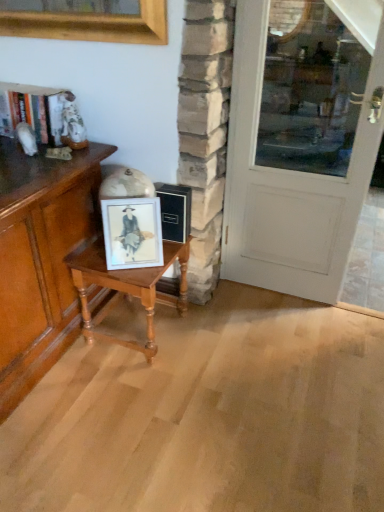
What do you see at coordinates (132, 233) in the screenshot?
I see `matte white frame at center` at bounding box center [132, 233].

This screenshot has height=512, width=384. I want to click on white painted wood door at right, so click(x=301, y=141).

Find the location of `matte white frame at center`. matte white frame at center is located at coordinates (132, 233).

How different are the orientations of wooden table at center and matte white frame at center in degrees?

They differ by 29.9 degrees in their facing directions.

Could matte white frame at center be considered to be inside wooden table at center?

No, matte white frame at center is not surrounded by wooden table at center.

Considering the positions of objects wooden table at center and matte white frame at center in the image provided, who is in front, wooden table at center or matte white frame at center?

Positioned in front is matte white frame at center.

Considering the sizes of wooden table at center and matte white frame at center in the image, is wooden table at center bigger or smaller than matte white frame at center?

In the image, wooden table at center appears to be larger than matte white frame at center.

Based on the photo, visually, is matte white frame at center positioned to the left or to the right of wooden table at center?

matte white frame at center is positioned on wooden table at center's right side.

In the image, is matte white frame at center positioned in front of or behind wooden table at center?

Visually, matte white frame at center is located in front of wooden table at center.

Considering the relative sizes of matte white frame at center and wooden table at center in the image provided, is matte white frame at center thinner than wooden table at center?

Yes, matte white frame at center is thinner than wooden table at center.

Is matte white frame at center in contact with wooden table at center?

No, matte white frame at center is not making contact with wooden table at center.

Is matte wood cabinet at left to the left of white painted wood door at right from the viewer's perspective?

Yes.

Find the location of a particular element. This screenshot has height=512, width=384. cabinetry that is below the white painted wood door at right (from the image's perspective) is located at coordinates (41, 259).

Is matte wood cabinet at left located outside white painted wood door at right?

Yes, matte wood cabinet at left is located beyond the bounds of white painted wood door at right.

Does white painted wood door at right have a greater height compared to matte wood cabinet at left?

Correct, white painted wood door at right is much taller as matte wood cabinet at left.

Consider the image. Could you tell me if white painted wood door at right is facing matte wood cabinet at left?

No.

Is white painted wood door at right thinner than matte wood cabinet at left?

Yes, white painted wood door at right is thinner than matte wood cabinet at left.

The width and height of the screenshot is (384, 512). I want to click on cabinetry on the left of white painted wood door at right, so click(41, 259).

Measure the distance from matte wood cabinet at left to wooden table at center.

matte wood cabinet at left is 8.88 inches from wooden table at center.

From the image's perspective, which is above, matte wood cabinet at left or wooden table at center?

matte wood cabinet at left appears higher in the image.

From a real-world perspective, does matte wood cabinet at left sit lower than wooden table at center?

Actually, matte wood cabinet at left is physically above wooden table at center in the real world.

Which of these two, matte wood cabinet at left or wooden table at center, is wider?

Wider between the two is matte wood cabinet at left.

Who is shorter, wooden table at center or white painted wood door at right?

wooden table at center is shorter.

The image size is (384, 512). I want to click on door above the wooden table at center (from a real-world perspective), so click(301, 141).

Which of these two, wooden table at center or white painted wood door at right, is smaller?

wooden table at center is smaller.

In the scene shown: Is there a large distance between wooden table at center and white painted wood door at right?

wooden table at center is positioned a significant distance from white painted wood door at right.

Identify the location of picture frame above the matte wood cabinet at left (from a real-world perspective). (132, 233).

Are matte wood cabinet at left and matte white frame at center located far from each other?

No, matte wood cabinet at left is not far away from matte white frame at center.

In the scene shown: Which point is more forward, (55, 317) or (129, 239)?

The point (129, 239) is more forward.

Identify the location of table on the left of matte white frame at center. This screenshot has height=512, width=384. (126, 288).

Image resolution: width=384 pixels, height=512 pixels. In the image, there is a matte white frame at center. In order to click on table below it (from a real-world perspective) in this screenshot , I will do `click(126, 288)`.

From the image, which object appears to be farther from wooden table at center, matte wood cabinet at left or white painted wood door at right?

white painted wood door at right lies further to wooden table at center than the other object.

From the image, which object appears to be farther from matte wood cabinet at left, white painted wood door at right or matte white frame at center?

white painted wood door at right.

Considering their positions, is white painted wood door at right positioned further to matte white frame at center than wooden table at center?

Based on the image, white painted wood door at right appears to be further to matte white frame at center.

Which object lies further to the anchor point matte wood cabinet at left, wooden table at center or white painted wood door at right?

white painted wood door at right is further to matte wood cabinet at left.

When comparing their distances from white painted wood door at right, does matte white frame at center or matte wood cabinet at left seem closer?

matte white frame at center is positioned closer to the anchor white painted wood door at right.

When comparing their distances from matte white frame at center, does wooden table at center or matte wood cabinet at left seem closer?

Among the two, wooden table at center is located nearer to matte white frame at center.

Which object lies further to the anchor point wooden table at center, matte white frame at center or matte wood cabinet at left?

Based on the image, matte wood cabinet at left appears to be further to wooden table at center.

Which object lies nearer to the anchor point white painted wood door at right, wooden table at center or matte wood cabinet at left?

The object closer to white painted wood door at right is wooden table at center.

You are a GUI agent. You are given a task and a screenshot of the screen. Output one action in this format:
    pyautogui.click(x=<x>, y=<y>)
    Task: Click on the table between matte wood cabinet at left and white painted wood door at right
    This screenshot has width=384, height=512.
    Given the screenshot: What is the action you would take?
    pyautogui.click(x=126, y=288)

This screenshot has width=384, height=512. I want to click on table between matte wood cabinet at left and matte white frame at center from left to right, so click(126, 288).

At what (x,y) coordinates should I click in order to perform the action: click on picture frame between matte wood cabinet at left and white painted wood door at right from left to right. Please return your answer as a coordinate pair (x, y). This screenshot has width=384, height=512. Looking at the image, I should click on (132, 233).

Find the location of `picture frame between wooden table at center and white painted wood door at right in the horizontal direction`. picture frame between wooden table at center and white painted wood door at right in the horizontal direction is located at coordinates (132, 233).